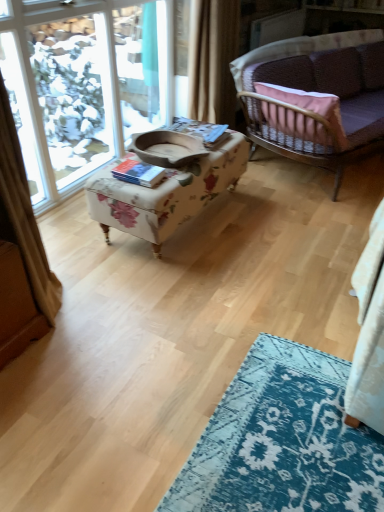
Question: In the image, is floral fabric ottoman at center positioned in front of or behind beige fabric curtain at upper center?

Choices:
 (A) front
 (B) behind

Answer: (A)

Question: Is point (198, 133) positioned closer to the camera than point (210, 18)?

Choices:
 (A) closer
 (B) farther

Answer: (A)

Question: Which is farther from the clear glass window at upper left?

Choices:
 (A) velvet purple couch at upper right
 (B) beige fabric curtain at upper center
 (C) floral fabric ottoman at center

Answer: (A)

Question: Based on their relative distances, which object is nearer to the floral fabric ottoman at center?

Choices:
 (A) beige fabric curtain at upper center
 (B) velvet purple couch at upper right
 (C) clear glass window at upper left

Answer: (A)